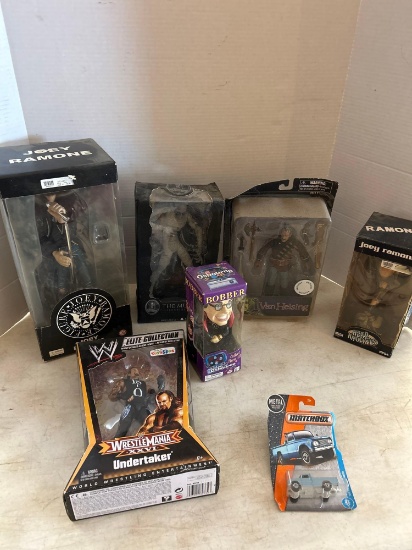
I want to click on toy, so click(x=132, y=392), click(x=220, y=320), click(x=175, y=221), click(x=57, y=216), click(x=278, y=252), click(x=375, y=290), click(x=310, y=491).